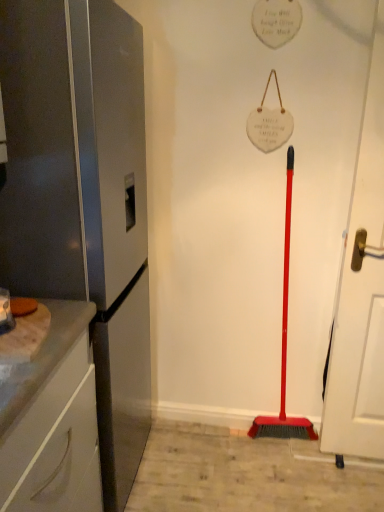
Where is `vacant area situated below white matte door at right (from a real-world perspective)`? The height and width of the screenshot is (512, 384). vacant area situated below white matte door at right (from a real-world perspective) is located at coordinates (357, 463).